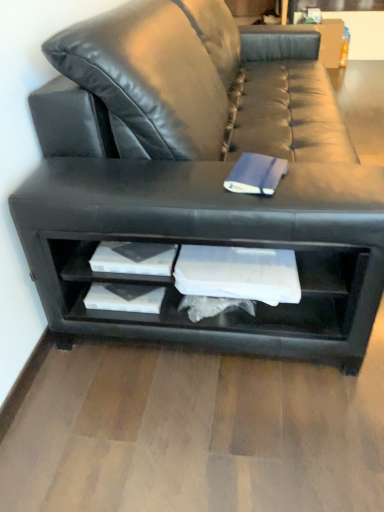
Question: Can you confirm if black leather shelf at lower center is positioned to the left of blue matte paper at center?

Choices:
 (A) yes
 (B) no

Answer: (A)

Question: From the image's perspective, is black leather shelf at lower center under blue matte paper at center?

Choices:
 (A) yes
 (B) no

Answer: (A)

Question: Could you tell me if black leather shelf at lower center is turned towards blue matte paper at center?

Choices:
 (A) yes
 (B) no

Answer: (B)

Question: Can you confirm if black leather shelf at lower center is shorter than blue matte paper at center?

Choices:
 (A) no
 (B) yes

Answer: (A)

Question: Is black leather shelf at lower center not near blue matte paper at center?

Choices:
 (A) no
 (B) yes

Answer: (A)

Question: Is black leather shelf at lower center touching blue matte paper at center?

Choices:
 (A) no
 (B) yes

Answer: (A)

Question: Is black leather couch at center positioned with its back to black leather shelf at lower center?

Choices:
 (A) no
 (B) yes

Answer: (A)

Question: Considering the relative sizes of black leather couch at center and black leather shelf at lower center in the image provided, is black leather couch at center smaller than black leather shelf at lower center?

Choices:
 (A) yes
 (B) no

Answer: (B)

Question: Considering the relative positions of black leather couch at center and black leather shelf at lower center in the image provided, is black leather couch at center to the left of black leather shelf at lower center from the viewer's perspective?

Choices:
 (A) yes
 (B) no

Answer: (B)

Question: Is black leather couch at center directly adjacent to black leather shelf at lower center?

Choices:
 (A) no
 (B) yes

Answer: (A)

Question: Would you say black leather shelf at lower center is part of black leather couch at center's contents?

Choices:
 (A) no
 (B) yes

Answer: (B)

Question: Is black leather couch at center positioned far away from black leather shelf at lower center?

Choices:
 (A) yes
 (B) no

Answer: (B)

Question: Is blue matte paper at center aimed at black leather shelf at lower center?

Choices:
 (A) no
 (B) yes

Answer: (A)